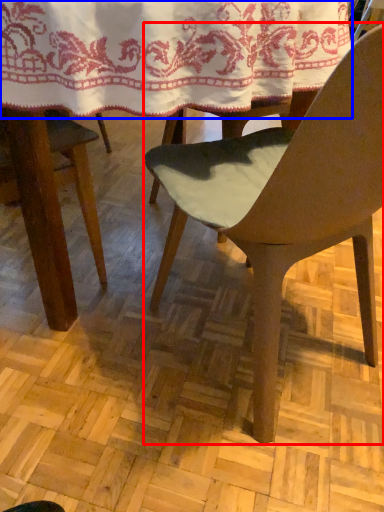
Question: Among these objects, which one is farthest to the camera, chair (highlighted by a red box) or blanket (highlighted by a blue box)?

Choices:
 (A) chair
 (B) blanket

Answer: (B)